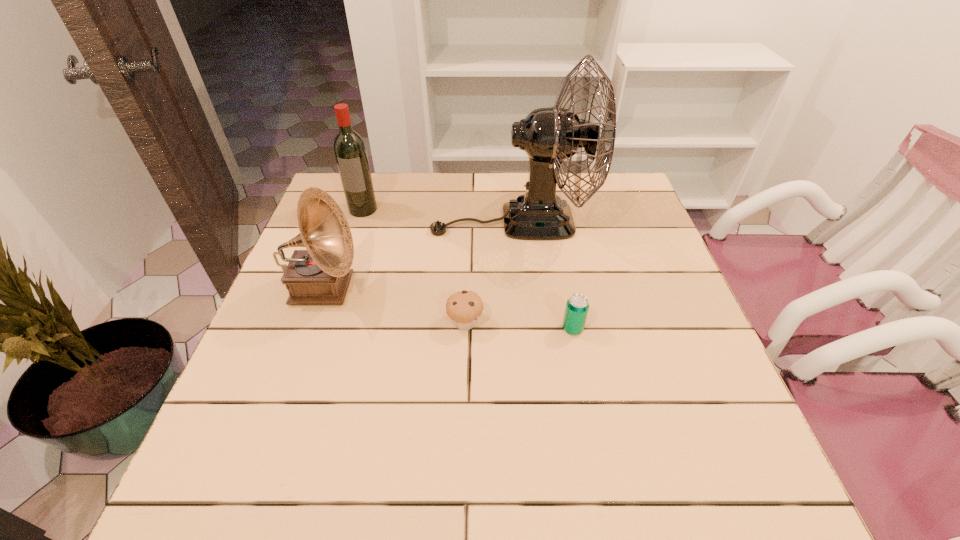
The image size is (960, 540). In the image, there is a desktop. Find the location of `vacant space at the left edge`. vacant space at the left edge is located at coordinates (304, 372).

The width and height of the screenshot is (960, 540). Identify the location of free space at the right edge of the desktop. (606, 219).

This screenshot has width=960, height=540. Identify the location of free region at the far right corner of the desktop. (597, 209).

Image resolution: width=960 pixels, height=540 pixels. In the image, there is a desktop. In order to click on free space at the near right corner in this screenshot , I will do 682,478.

Where is `empty space that is in between the beer can and the fan`? empty space that is in between the beer can and the fan is located at coordinates (542, 275).

This screenshot has height=540, width=960. I want to click on blank region between the beer can and the fan, so click(x=542, y=275).

At what (x,y) coordinates should I click in order to perform the action: click on empty location between the wine bottle and the muffin. Please return your answer as a coordinate pair (x, y). This screenshot has height=540, width=960. Looking at the image, I should click on (414, 266).

Locate an element on the screen. This screenshot has width=960, height=540. blank region between the beer can and the tallest object is located at coordinates (542, 275).

Where is `vacant point located between the fan and the beer can`? vacant point located between the fan and the beer can is located at coordinates (542, 275).

Where is `free space between the muffin and the fan`? Image resolution: width=960 pixels, height=540 pixels. free space between the muffin and the fan is located at coordinates (489, 272).